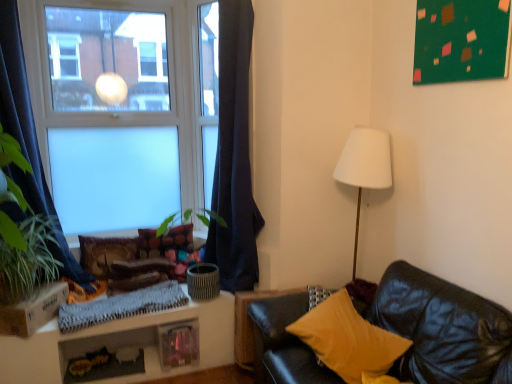
Question: Visually, is yellow fabric pillow at lower right, the 1th pillow in the front-to-back sequence, positioned to the left or to the right of dark blue fabric curtain at left, the 2th curtain in the right-to-left sequence?

Choices:
 (A) left
 (B) right

Answer: (B)

Question: In terms of height, does yellow fabric pillow at lower right, which is counted as the 3th pillow, starting from the back, look taller or shorter compared to dark blue fabric curtain at left, the 2th curtain in the right-to-left sequence?

Choices:
 (A) tall
 (B) short

Answer: (B)

Question: Estimate the real-world distances between objects in this image. Which object is farther from the white knitted blanket at lower left?

Choices:
 (A) translucent glass jar at lower center
 (B) green leafy plant at left
 (C) velvet textured pillow at center, marked as the 3th pillow in a front-to-back arrangement
 (D) matte glass window at upper left
 (E) dark blue fabric curtain at left, the 1th curtain from the right

Answer: (D)

Question: Which is farther from the matte glass window at upper left?

Choices:
 (A) white knitted blanket at lower left
 (B) velvet textured pillow at center, which is the 1th pillow from back to front
 (C) textured brown pillow at lower left, the 3th pillow positioned from the right
 (D) translucent glass jar at lower center
 (E) green leafy plant at left

Answer: (D)